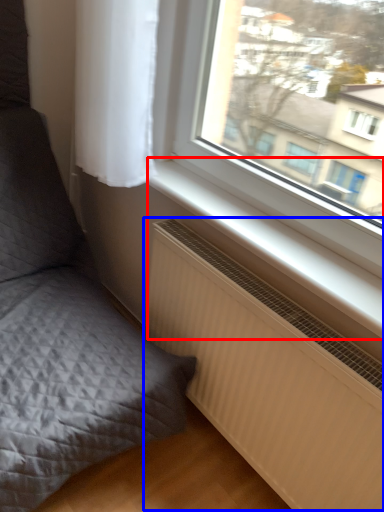
Question: Which point is further to the camera, window sill (highlighted by a red box) or radiator (highlighted by a blue box)?

Choices:
 (A) window sill
 (B) radiator

Answer: (A)